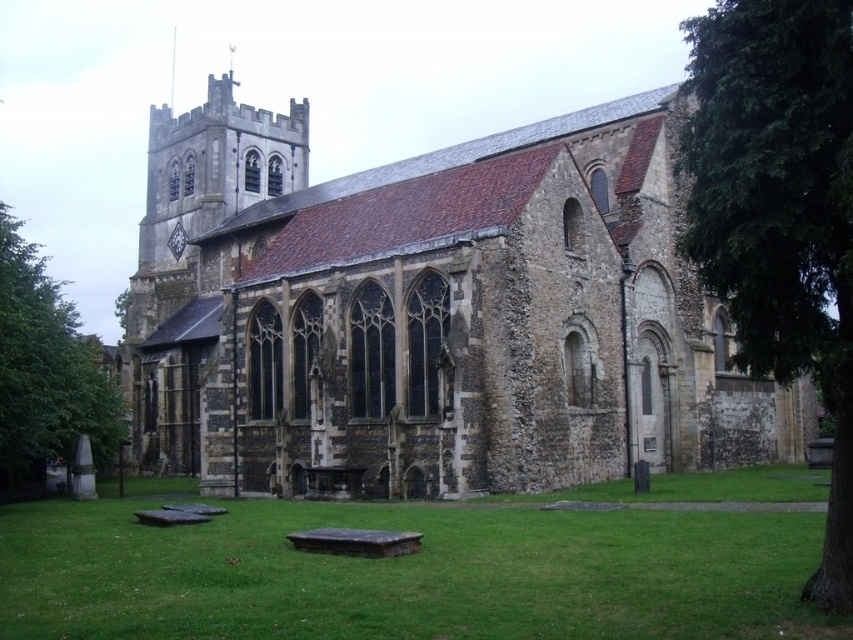
You are standing on the grassy lawn in front of the historic stone church. You notice a point marked at coordinates (x=430, y=310). Based on the church layout, what significant structure does this point most likely represent?

The point at coordinates (x=430, y=310) most likely represents the location of the brown stone church at center, as the description states that the brown stone church at center is represented by that point.

You are standing in the churchyard and want to take a photo of the brown stone church at center. However, there is a green leafy tree at right in the way. Can you see the entire church without the tree blocking it?

The green leafy tree at right is behind the brown stone church at center, so the tree is not blocking the view of the church. You can see the entire church without any obstruction from the tree.

You are planning to place a picnic blanket in the churchyard. The green grass at lower center and the green leafy tree at right are both visible. Which area would allow the blanket to spread out more comfortably without overcrowding?

The green leafy tree at right allows the picnic blanket to spread out more comfortably because it occupies more space than the green grass at lower center.